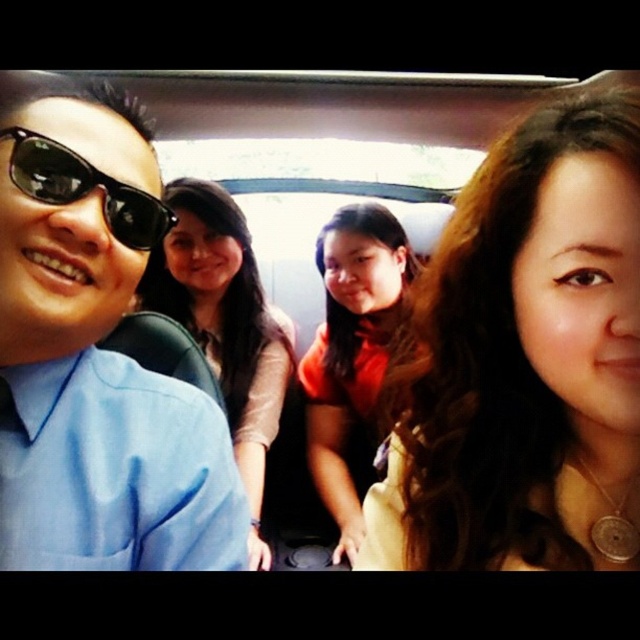
Can you confirm if matte gold necklace at center is smaller than orange matte shirt at center?

Correct, matte gold necklace at center occupies less space than orange matte shirt at center.

Between matte gold necklace at center and orange matte shirt at center, which one appears on the left side from the viewer's perspective?

Positioned to the left is orange matte shirt at center.

Describe the element at coordinates (525, 362) in the screenshot. I see `matte gold necklace at center` at that location.

The image size is (640, 640). I want to click on matte gold necklace at center, so click(x=525, y=362).

Who is higher up, matte blue shirt at left or matte brown hair at center?

Positioned higher is matte blue shirt at left.

You are a GUI agent. You are given a task and a screenshot of the screen. Output one action in this format:
    pyautogui.click(x=<x>, y=<y>)
    Task: Click on the matte blue shirt at left
    
    Given the screenshot: What is the action you would take?
    pyautogui.click(x=96, y=362)

Looking at this image, is matte gold necklace at center thinner than black matte sunglasses at left?

No, matte gold necklace at center is not thinner than black matte sunglasses at left.

Is matte gold necklace at center closer to camera compared to black matte sunglasses at left?

Yes, it is.

At what (x,y) coordinates should I click in order to perform the action: click on matte gold necklace at center. Please return your answer as a coordinate pair (x, y). Looking at the image, I should click on (525, 362).